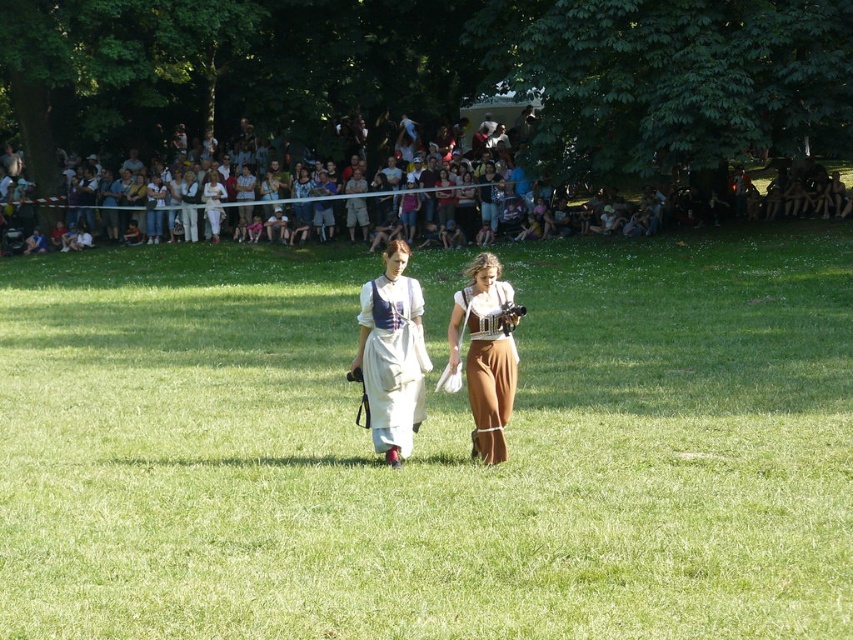
You are standing at the origin point in the image. Which direction should you move to reach the green grass at center?

The green grass at center is located at the 2D coordinates point of (x=428, y=448), so you should move towards the right and slightly downward from your current position at the origin point to reach it.

You are standing in the grassy field and want to locate the white casual clothing at upper center. According to the coordinates provided, where should you look?

You should look at point 0.322 on the x axis and 0.474 on the y axis to find the white casual clothing at upper center.

You are a photographer standing in the field and want to take a photo that includes both the green grass at center and the white casual clothing at upper center. Which object will appear larger in the photo?

The green grass at center will appear larger in the photo because it is closer to the viewer than the white casual clothing at upper center.